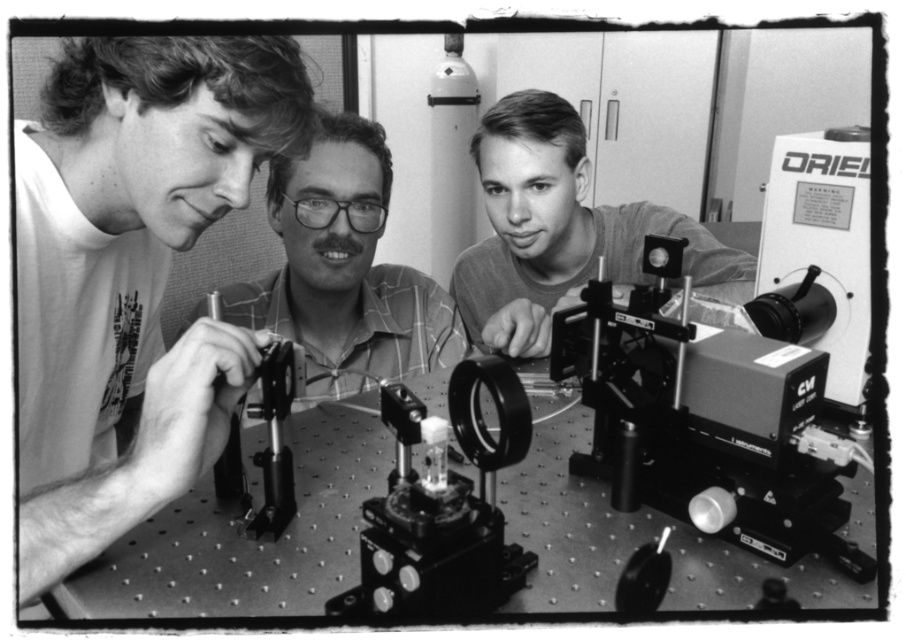
Question: Based on their relative distances, which object is farther from the metallic silver lens at lower right?

Choices:
 (A) smooth plastic camera at center
 (B) metallic black lens at center
 (C) plaid shirt at center
 (D) metallic gray microscope at center-right

Answer: (A)

Question: Does metallic gray microscope at center-right appear on the left side of smooth plastic camera at center?

Choices:
 (A) yes
 (B) no

Answer: (B)

Question: In this image, where is smooth plastic camera at center located relative to metallic black lens at center?

Choices:
 (A) below
 (B) above

Answer: (B)

Question: Which point is farther from the camera taking this photo?

Choices:
 (A) [730, 508]
 (B) [288, 314]
 (C) [413, 515]
 (D) [747, 529]

Answer: (B)

Question: Does plaid shirt at center lie behind smooth plastic camera at center?

Choices:
 (A) no
 (B) yes

Answer: (A)

Question: Among these objects, which one is farthest from the camera?

Choices:
 (A) smooth plastic camera at center
 (B) matte white shirt at left
 (C) metallic black lens at center
 (D) metallic silver lens at lower right

Answer: (A)